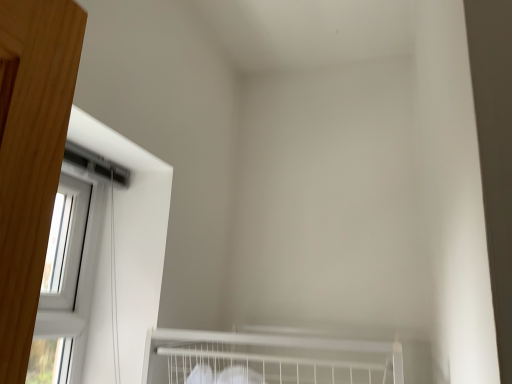
This screenshot has width=512, height=384. What do you see at coordinates (71, 265) in the screenshot?
I see `white plastic window at left` at bounding box center [71, 265].

This screenshot has width=512, height=384. What are the coordinates of `white plastic window at left` in the screenshot? It's located at (71, 265).

Where is `white plastic window at left`? This screenshot has width=512, height=384. white plastic window at left is located at coordinates (71, 265).